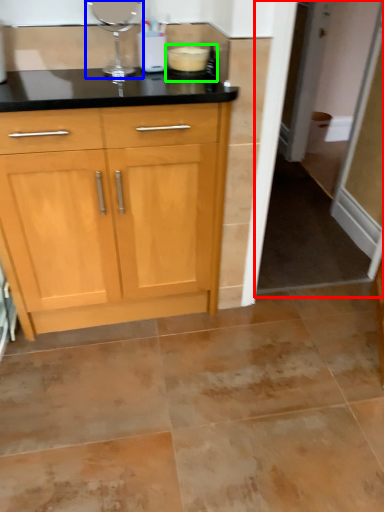
Question: Estimate the real-world distances between objects in this image. Which object is farther from screen door (highlighted by a red box), appliance (highlighted by a blue box) or appliance (highlighted by a green box)?

Choices:
 (A) appliance
 (B) appliance

Answer: (A)